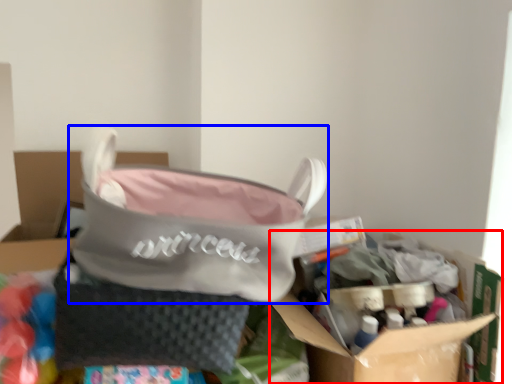
Question: Which object appears closest to the camera in this image, cardboard box (highlighted by a red box) or handbag (highlighted by a blue box)?

Choices:
 (A) cardboard box
 (B) handbag

Answer: (B)